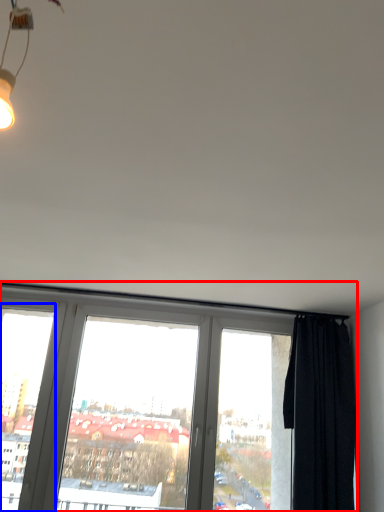
Question: Which of the following is the farthest to the observer, window (highlighted by a red box) or window frame (highlighted by a blue box)?

Choices:
 (A) window
 (B) window frame

Answer: (B)